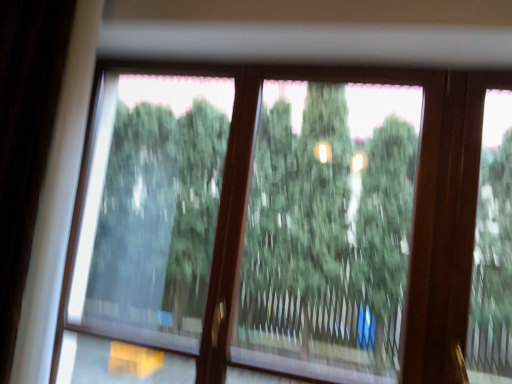
Locate an element on the screen. The width and height of the screenshot is (512, 384). green matte tree at center, which ranks as the second tree in left-to-right order is located at coordinates (328, 231).

What do you see at coordinates (328, 231) in the screenshot? I see `green matte tree at center, positioned as the 1th tree in right-to-left order` at bounding box center [328, 231].

What do you see at coordinates (158, 217) in the screenshot? I see `green matte tree at center, acting as the second tree starting from the right` at bounding box center [158, 217].

Image resolution: width=512 pixels, height=384 pixels. In order to click on green matte tree at center, acting as the second tree starting from the right in this screenshot , I will do `click(158, 217)`.

Find the location of a particular element. green matte tree at center, which ranks as the second tree in left-to-right order is located at coordinates (328, 231).

Between green matte tree at center, which ranks as the second tree in left-to-right order, and green matte tree at center, the first tree from the left, which one appears on the right side from the viewer's perspective?

green matte tree at center, which ranks as the second tree in left-to-right order.

From the picture: Considering their positions, is green matte tree at center, positioned as the 1th tree in right-to-left order, located in front of or behind green matte tree at center, the first tree from the left?

In the image, green matte tree at center, positioned as the 1th tree in right-to-left order, appears in front of green matte tree at center, the first tree from the left.

Which point is more distant from viewer, (305, 326) or (203, 295)?

The point (305, 326) is behind.

In the scene shown: From the image's perspective, is green matte tree at center, which ranks as the second tree in left-to-right order, above or below green matte tree at center, the first tree from the left?

Based on their image positions, green matte tree at center, which ranks as the second tree in left-to-right order, is located beneath green matte tree at center, the first tree from the left.

From a real-world perspective, between green matte tree at center, which ranks as the second tree in left-to-right order, and green matte tree at center, acting as the second tree starting from the right, who is vertically lower?

green matte tree at center, acting as the second tree starting from the right, is physically lower.

Considering the sizes of green matte tree at center, which ranks as the second tree in left-to-right order, and green matte tree at center, the first tree from the left, in the image, is green matte tree at center, which ranks as the second tree in left-to-right order, wider or thinner than green matte tree at center, the first tree from the left,?

green matte tree at center, which ranks as the second tree in left-to-right order, is wider than green matte tree at center, the first tree from the left.

Is green matte tree at center, which ranks as the second tree in left-to-right order, taller or shorter than green matte tree at center, the first tree from the left?

Clearly, green matte tree at center, which ranks as the second tree in left-to-right order, is shorter compared to green matte tree at center, the first tree from the left.

Considering the relative sizes of green matte tree at center, positioned as the 1th tree in right-to-left order, and green matte tree at center, acting as the second tree starting from the right, in the image provided, is green matte tree at center, positioned as the 1th tree in right-to-left order, smaller than green matte tree at center, acting as the second tree starting from the right,?

No.

Would you say green matte tree at center, positioned as the 1th tree in right-to-left order, contains green matte tree at center, acting as the second tree starting from the right?

No.

In the scene shown: Is the surface of green matte tree at center, positioned as the 1th tree in right-to-left order, in direct contact with green matte tree at center, acting as the second tree starting from the right?

No.

Is green matte tree at center, which ranks as the second tree in left-to-right order, oriented towards green matte tree at center, the first tree from the left?

No, green matte tree at center, which ranks as the second tree in left-to-right order, does not turn towards green matte tree at center, the first tree from the left.

Can you tell me how much green matte tree at center, which ranks as the second tree in left-to-right order, and green matte tree at center, acting as the second tree starting from the right, differ in facing direction?

The facing directions of green matte tree at center, which ranks as the second tree in left-to-right order, and green matte tree at center, acting as the second tree starting from the right, are 0.306 degrees apart.

Locate an element on the screen. This screenshot has height=384, width=512. tree in front of the green matte tree at center, acting as the second tree starting from the right is located at coordinates (328, 231).

Considering the positions of objects green matte tree at center, acting as the second tree starting from the right, and green matte tree at center, which ranks as the second tree in left-to-right order, in the image provided, who is more to the left, green matte tree at center, acting as the second tree starting from the right, or green matte tree at center, which ranks as the second tree in left-to-right order,?

green matte tree at center, acting as the second tree starting from the right.

Looking at this image, is green matte tree at center, the first tree from the left, further to the viewer compared to green matte tree at center, positioned as the 1th tree in right-to-left order?

Yes, the depth of green matte tree at center, the first tree from the left, is greater than that of green matte tree at center, positioned as the 1th tree in right-to-left order.

Which is in front, point (189, 149) or point (410, 152)?

The point (189, 149) is closer to the camera.

From the image's perspective, who appears lower, green matte tree at center, acting as the second tree starting from the right, or green matte tree at center, which ranks as the second tree in left-to-right order?

From the image's view, green matte tree at center, which ranks as the second tree in left-to-right order, is below.

From a real-world perspective, is green matte tree at center, acting as the second tree starting from the right, positioned above or below green matte tree at center, positioned as the 1th tree in right-to-left order?

From a real-world perspective, green matte tree at center, acting as the second tree starting from the right, is physically below green matte tree at center, positioned as the 1th tree in right-to-left order.

Considering the relative sizes of green matte tree at center, the first tree from the left, and green matte tree at center, which ranks as the second tree in left-to-right order, in the image provided, is green matte tree at center, the first tree from the left, thinner than green matte tree at center, which ranks as the second tree in left-to-right order,?

Yes, green matte tree at center, the first tree from the left, is thinner than green matte tree at center, which ranks as the second tree in left-to-right order.

Can you confirm if green matte tree at center, acting as the second tree starting from the right, is shorter than green matte tree at center, which ranks as the second tree in left-to-right order?

In fact, green matte tree at center, acting as the second tree starting from the right, may be taller than green matte tree at center, which ranks as the second tree in left-to-right order.

Is green matte tree at center, acting as the second tree starting from the right, smaller than green matte tree at center, which ranks as the second tree in left-to-right order?

Yes.

Can we say green matte tree at center, the first tree from the left, lies outside green matte tree at center, positioned as the 1th tree in right-to-left order?

That's correct, green matte tree at center, the first tree from the left, is outside of green matte tree at center, positioned as the 1th tree in right-to-left order.

In the scene shown: Is green matte tree at center, the first tree from the left, directly adjacent to green matte tree at center, positioned as the 1th tree in right-to-left order?

No, green matte tree at center, the first tree from the left, is not with green matte tree at center, positioned as the 1th tree in right-to-left order.

Is green matte tree at center, acting as the second tree starting from the right, facing towards green matte tree at center, positioned as the 1th tree in right-to-left order?

No.

Looking at this image, can you tell me how much green matte tree at center, the first tree from the left, and green matte tree at center, which ranks as the second tree in left-to-right order, differ in facing direction?

There is a 0.306-degree angle between the facing directions of green matte tree at center, the first tree from the left, and green matte tree at center, which ranks as the second tree in left-to-right order.

How much distance is there between green matte tree at center, the first tree from the left, and green matte tree at center, positioned as the 1th tree in right-to-left order?

They are 32.03 inches apart.

The height and width of the screenshot is (384, 512). Identify the location of tree located on the right of green matte tree at center, acting as the second tree starting from the right. (328, 231).

Where is `tree that is in front of the green matte tree at center, acting as the second tree starting from the right`? The image size is (512, 384). tree that is in front of the green matte tree at center, acting as the second tree starting from the right is located at coordinates (328, 231).

Where is `tree below the green matte tree at center, the first tree from the left (from the image's perspective)`? This screenshot has height=384, width=512. tree below the green matte tree at center, the first tree from the left (from the image's perspective) is located at coordinates pyautogui.click(x=328, y=231).